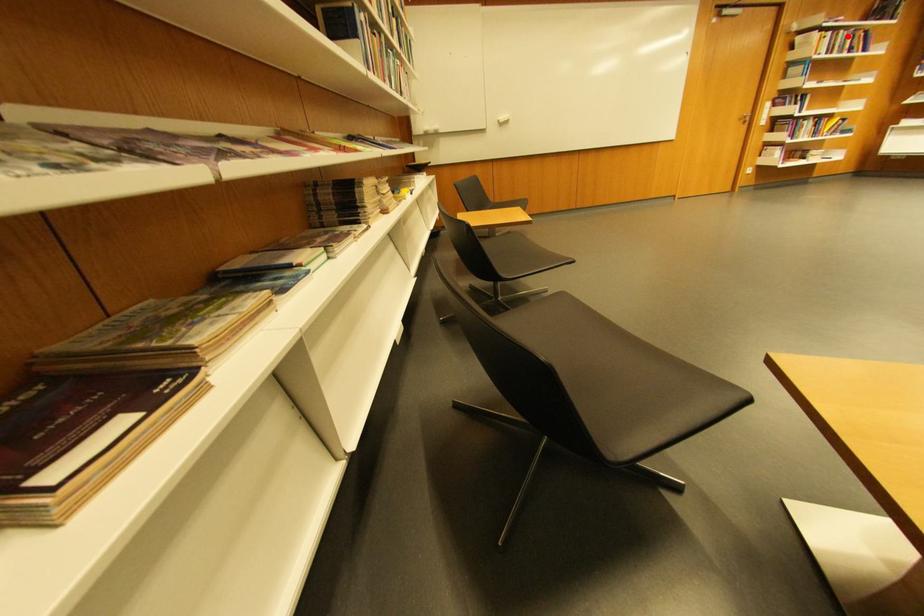
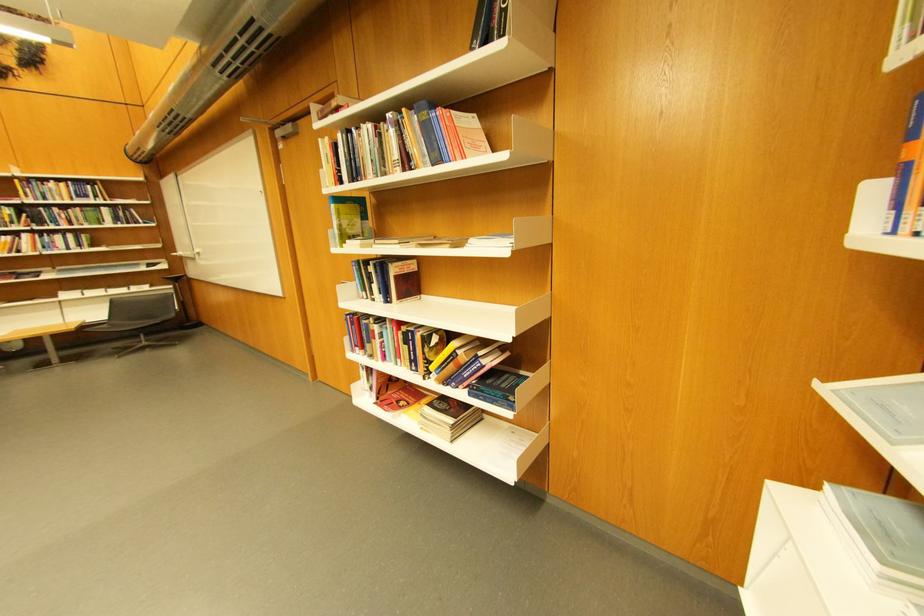
Question: I am providing you with two images of the same scene from different viewpoints. A red point is shown in image1. For the corresponding object point in image2, is it positioned nearer or farther from the camera?

Choices:
 (A) Nearer
 (B) Farther

Answer: (A)